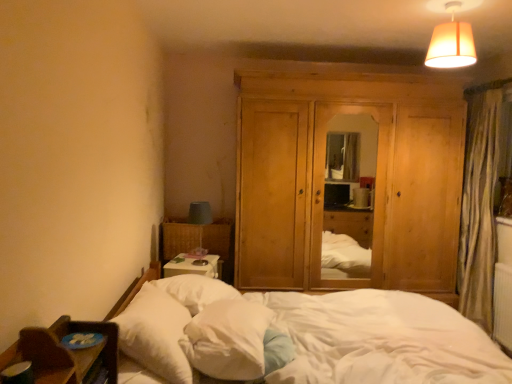
Question: In terms of height, does white soft pillow at lower left, which ranks as the second pillow in right-to-left order, look taller or shorter compared to white soft pillow at center, the second pillow when ordered from left to right?

Choices:
 (A) short
 (B) tall

Answer: (B)

Question: From the image's perspective, is white soft pillow at lower left, which ranks as the second pillow in right-to-left order, above or below white soft pillow at center, the first pillow when ordered from right to left?

Choices:
 (A) below
 (B) above

Answer: (B)

Question: Which object is the closest to the white soft bed at lower left?

Choices:
 (A) white soft pillow at center, the second pillow when ordered from left to right
 (B) matte beige lampshade at upper right
 (C) white soft pillow at lower left, which appears as the first pillow when viewed from the left
 (D) natural wood dresser at center

Answer: (A)

Question: Which object is the farthest from the matte beige lampshade at upper right?

Choices:
 (A) white soft bed at lower left
 (B) white soft pillow at center, the first pillow when ordered from right to left
 (C) white soft pillow at lower left, which appears as the first pillow when viewed from the left
 (D) natural wood dresser at center

Answer: (C)